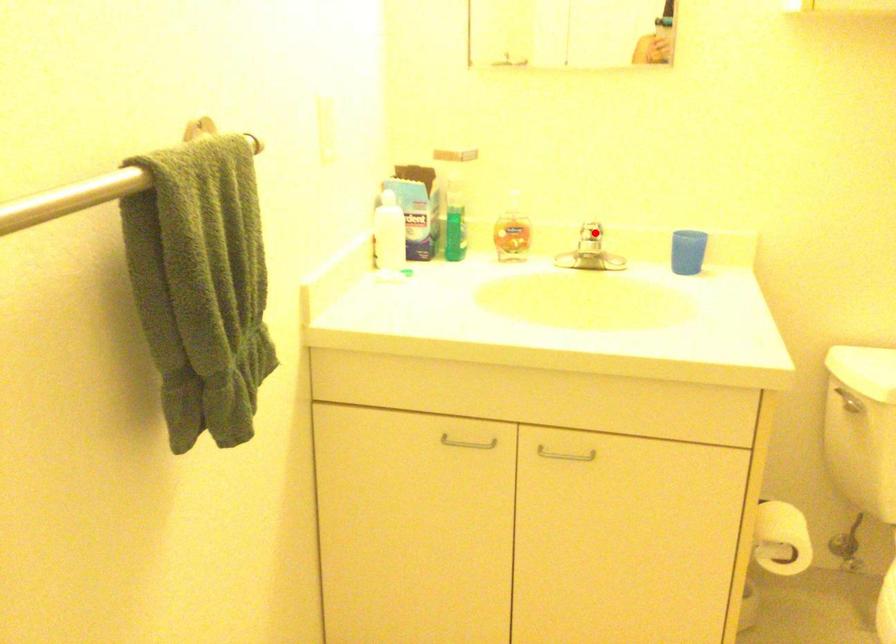
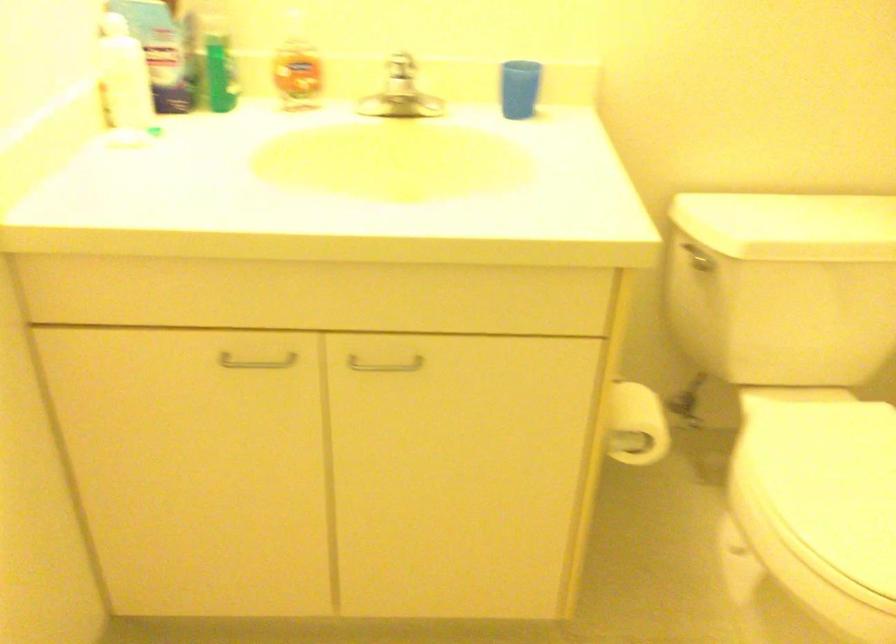
Where in the second image is the point corresponding to the highlighted location from the first image?

(401, 66)